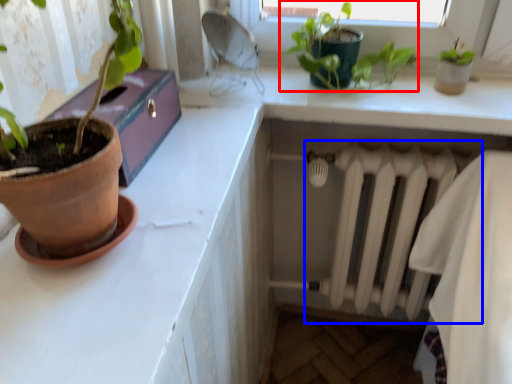
Question: Which of the following is the farthest to the observer, houseplant (highlighted by a red box) or radiator (highlighted by a blue box)?

Choices:
 (A) houseplant
 (B) radiator

Answer: (B)